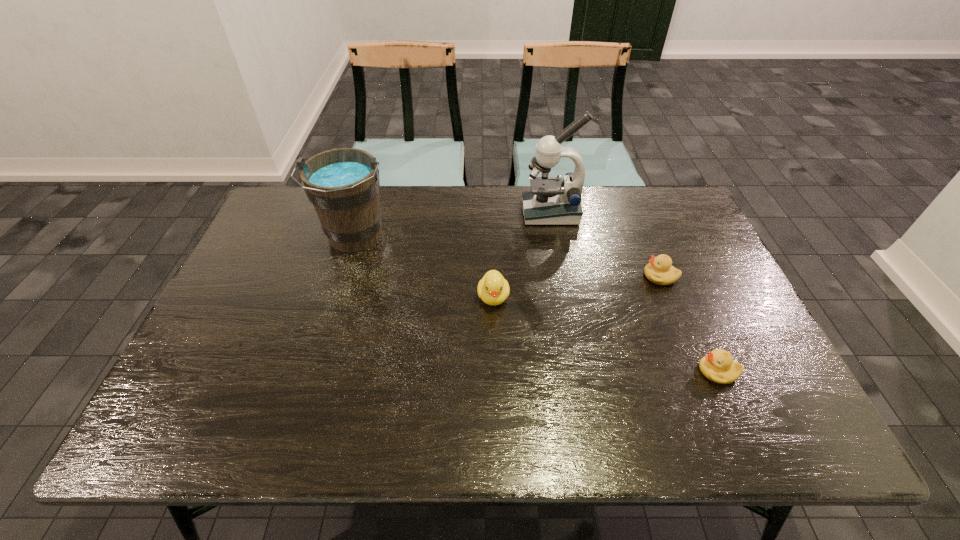
Where is `vacant space that's between the microscope and the second object from left to right`? This screenshot has height=540, width=960. vacant space that's between the microscope and the second object from left to right is located at coordinates (522, 254).

Find the location of a particular element. This screenshot has width=960, height=540. vacant area that lies between the nearest object and the fourth shortest object is located at coordinates (537, 304).

Locate an element on the screen. The image size is (960, 540). empty location between the nearest object and the wine bucket is located at coordinates (537, 304).

Identify the location of blank region between the nearest object and the leftmost duckling. The height and width of the screenshot is (540, 960). (606, 334).

Locate an element on the screen. The image size is (960, 540). free space between the nearest object and the third object from left to right is located at coordinates (635, 292).

What are the coordinates of `empty space that is in between the second tallest object and the nearest duckling` in the screenshot? It's located at (537, 304).

Locate an element on the screen. This screenshot has width=960, height=540. empty space that is in between the nearest object and the microscope is located at coordinates (635, 292).

Find the location of a particular element. This screenshot has width=960, height=540. object that stands as the fourth closest to the leftmost duckling is located at coordinates (718, 366).

Select which object is the closest to the nearest object. Please provide its 2D coordinates. Your answer should be formatted as a tuple, i.e. [(x, y)], where the tuple contains the x and y coordinates of a point satisfying the conditions above.

[(660, 271)]

At what (x,y) coordinates should I click in order to perform the action: click on duckling that is the second nearest to the nearest object. Please return your answer as a coordinate pair (x, y). The image size is (960, 540). Looking at the image, I should click on (493, 289).